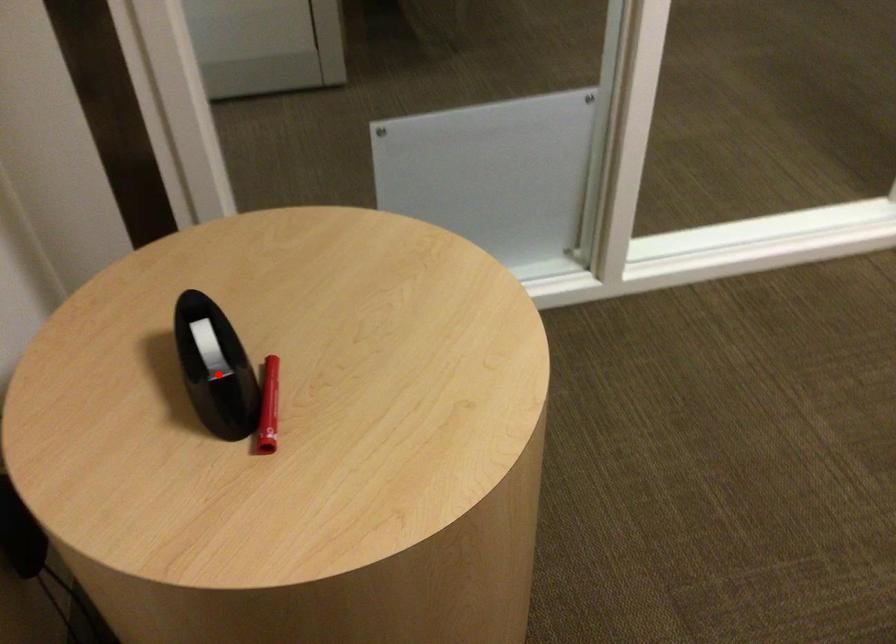
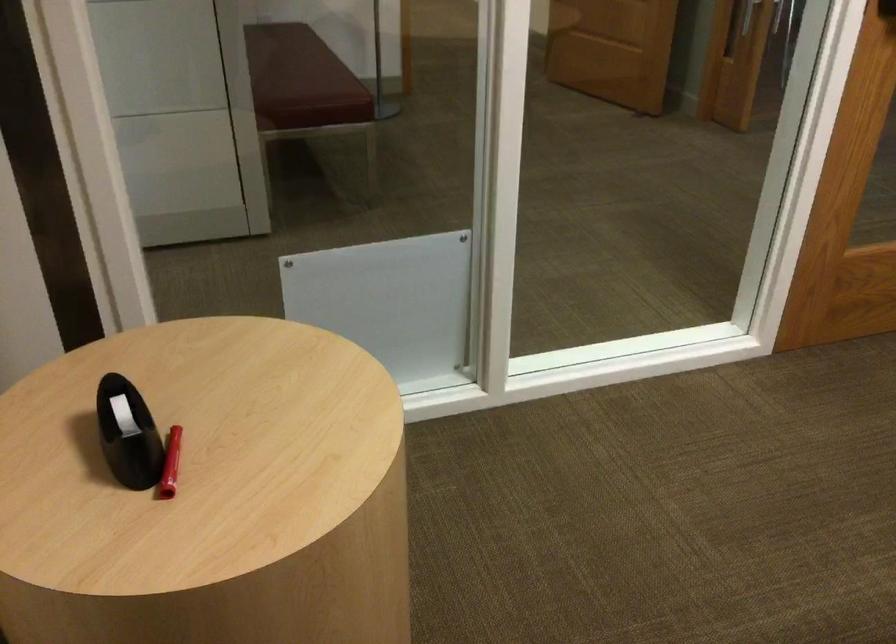
Question: I am providing you with two images of the same scene from different viewpoints. A red point is shown in image1. For the corresponding object point in image2, is it positioned nearer or farther from the camera?

Choices:
 (A) Nearer
 (B) Farther

Answer: (B)